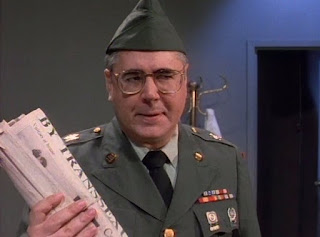
Locate an element on the screen. coat rack is located at coordinates (195, 106).